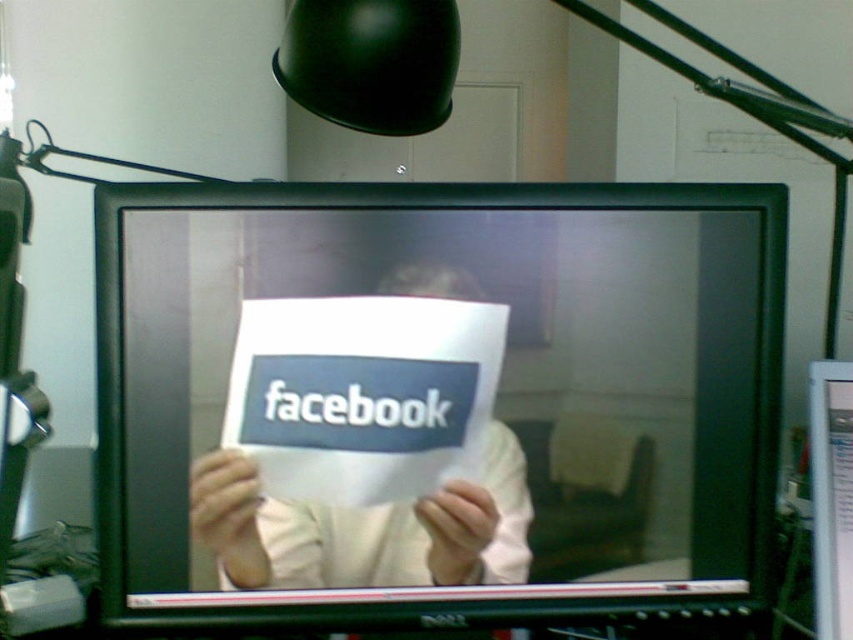
Can you confirm if black glossy monitor at center is taller than white paper at center?

Correct, black glossy monitor at center is much taller as white paper at center.

Does black glossy monitor at center appear under white paper at center?

Incorrect, black glossy monitor at center is not positioned below white paper at center.

Is point (503, 541) in front of point (364, 525)?

That is False.

You are a GUI agent. You are given a task and a screenshot of the screen. Output one action in this format:
    pyautogui.click(x=<x>, y=<y>)
    Task: Click on the black glossy monitor at center
    The image size is (853, 640).
    Given the screenshot: What is the action you would take?
    pyautogui.click(x=434, y=401)